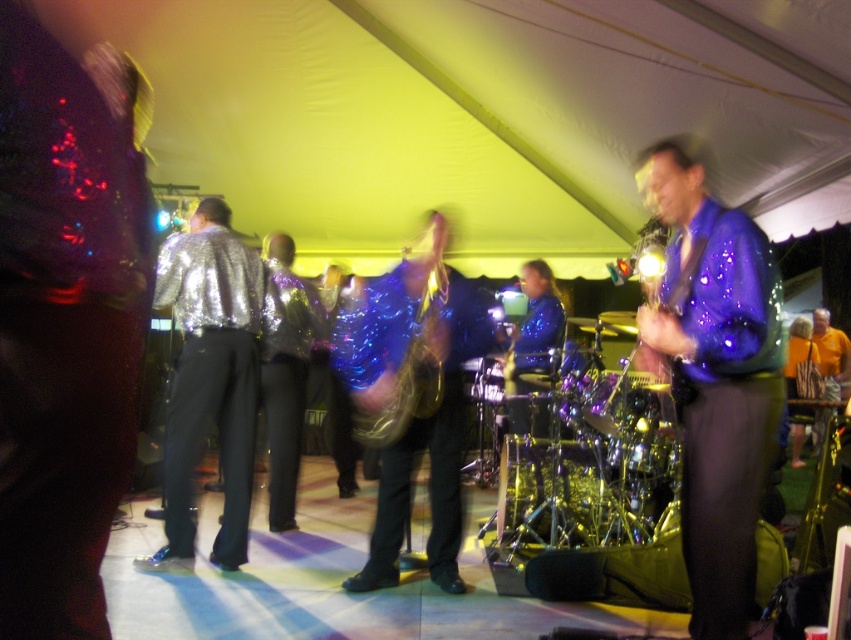
Is shiny purple jacket at right to the left of shiny silver jacket at left from the viewer's perspective?

Incorrect, shiny purple jacket at right is not on the left side of shiny silver jacket at left.

Who is taller, shiny purple jacket at right or shiny silver jacket at left?

shiny silver jacket at left is taller.

Which is in front, point (768, 324) or point (186, 499)?

Point (768, 324) is in front.

I want to click on shiny purple jacket at right, so click(715, 380).

Looking at this image, is shiny purple jacket at right further to the viewer compared to shiny metallic drum at center?

No, it is not.

Image resolution: width=851 pixels, height=640 pixels. What do you see at coordinates (715, 380) in the screenshot? I see `shiny purple jacket at right` at bounding box center [715, 380].

Where is `shiny purple jacket at right`? shiny purple jacket at right is located at coordinates (715, 380).

Is shiny silver jacket at left to the right of shiny metallic drum at center from the viewer's perspective?

No, shiny silver jacket at left is not to the right of shiny metallic drum at center.

Who is shorter, shiny silver jacket at left or shiny metallic drum at center?

shiny metallic drum at center is shorter.

Does point (181, 456) lie behind point (666, 410)?

No, it is not.

Where is `shiny silver jacket at left`? shiny silver jacket at left is located at coordinates (210, 378).